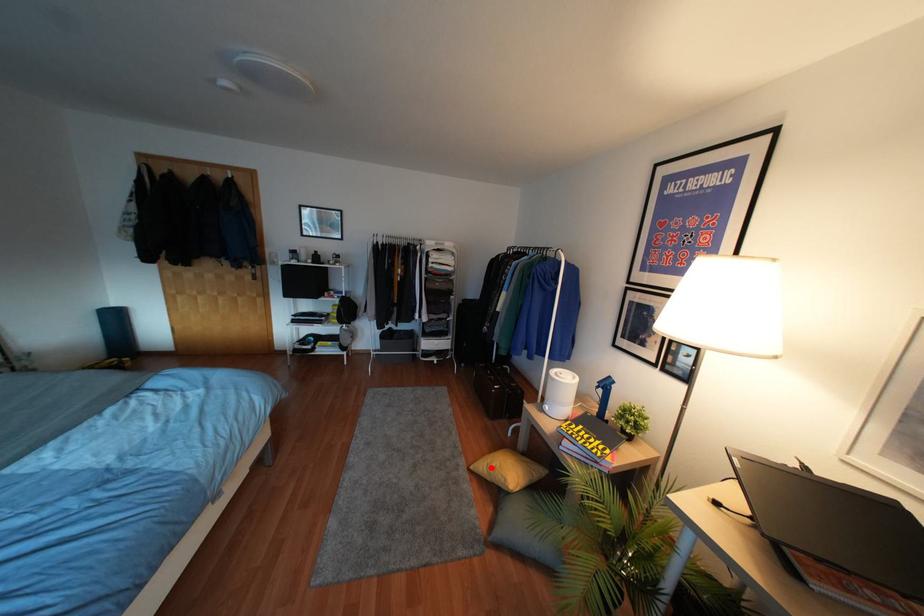
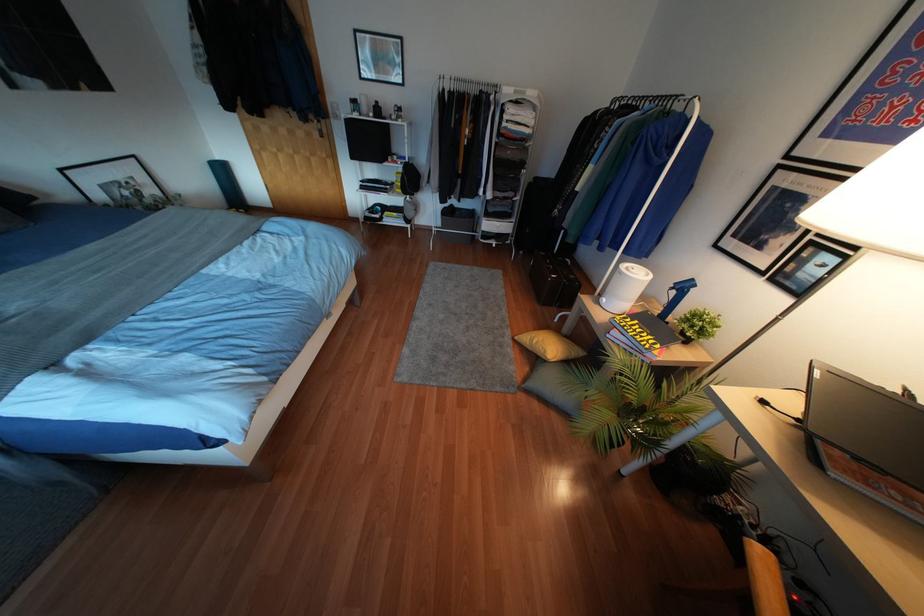
The point at the highlighted location is marked in the first image. Where is the corresponding point in the second image?

(533, 341)